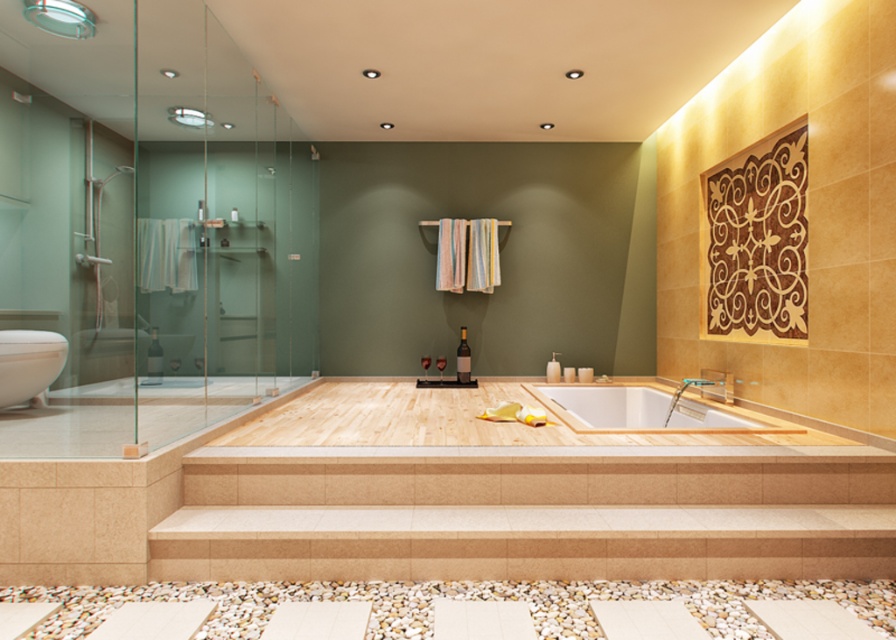
In the scene shown: Does white wood bathtub at center appear under white glossy bathtub at lower left?

Indeed, white wood bathtub at center is positioned under white glossy bathtub at lower left.

Who is positioned more to the right, white wood bathtub at center or white glossy bathtub at lower left?

white wood bathtub at center

What do you see at coordinates (643, 410) in the screenshot? I see `white wood bathtub at center` at bounding box center [643, 410].

This screenshot has width=896, height=640. In order to click on white wood bathtub at center in this screenshot , I will do `click(643, 410)`.